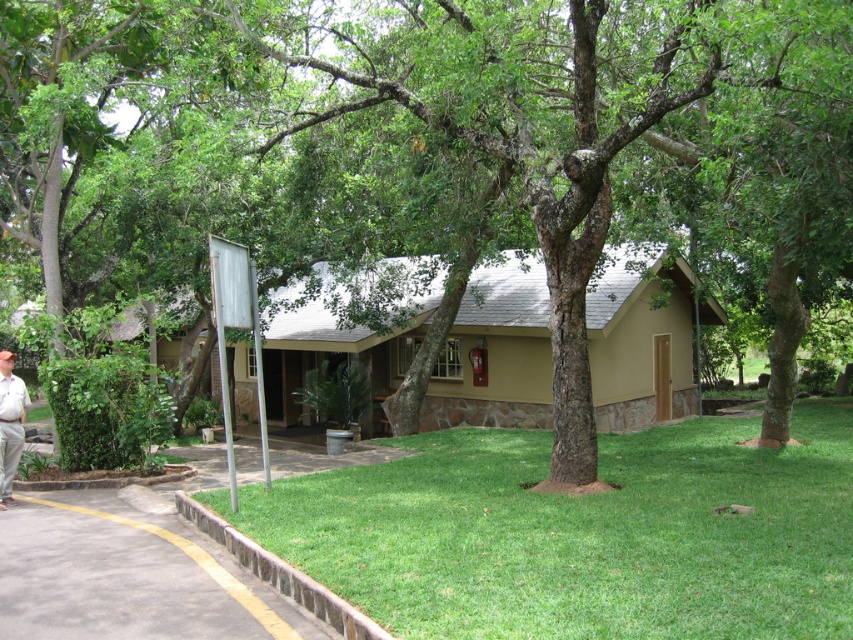
Question: Among these objects, which one is farthest from the camera?

Choices:
 (A) gray asphalt pavement at lower left
 (B) green grass at lower center

Answer: (A)

Question: Which object appears farthest from the camera in this image?

Choices:
 (A) gray asphalt pavement at lower left
 (B) green grass at lower center
 (C) light beige pants at lower left

Answer: (C)

Question: Is green grass at lower center bigger than light beige pants at lower left?

Choices:
 (A) no
 (B) yes

Answer: (B)

Question: Which point is farther to the camera?

Choices:
 (A) light beige pants at lower left
 (B) gray asphalt pavement at lower left

Answer: (A)

Question: Can you confirm if gray asphalt pavement at lower left is positioned above light beige pants at lower left?

Choices:
 (A) no
 (B) yes

Answer: (A)

Question: Can you confirm if green grass at lower center is positioned to the right of gray asphalt pavement at lower left?

Choices:
 (A) yes
 (B) no

Answer: (A)